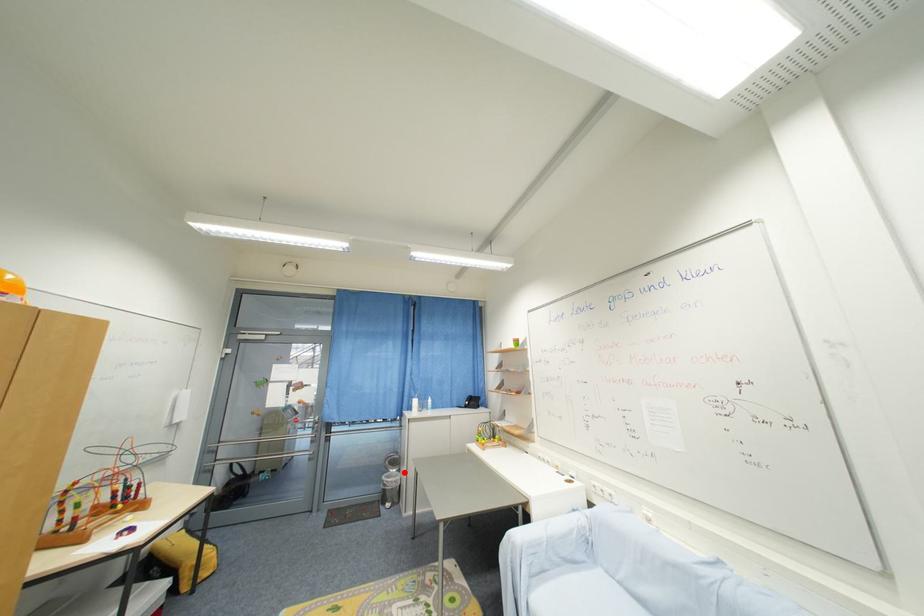
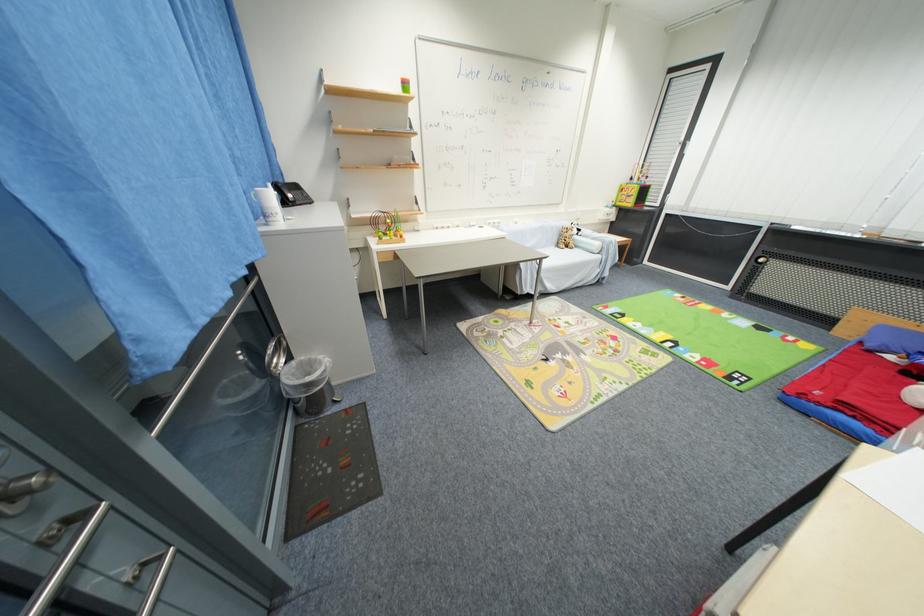
Locate, in the second image, the point that corresponds to the highlighted location in the first image.

(295, 360)